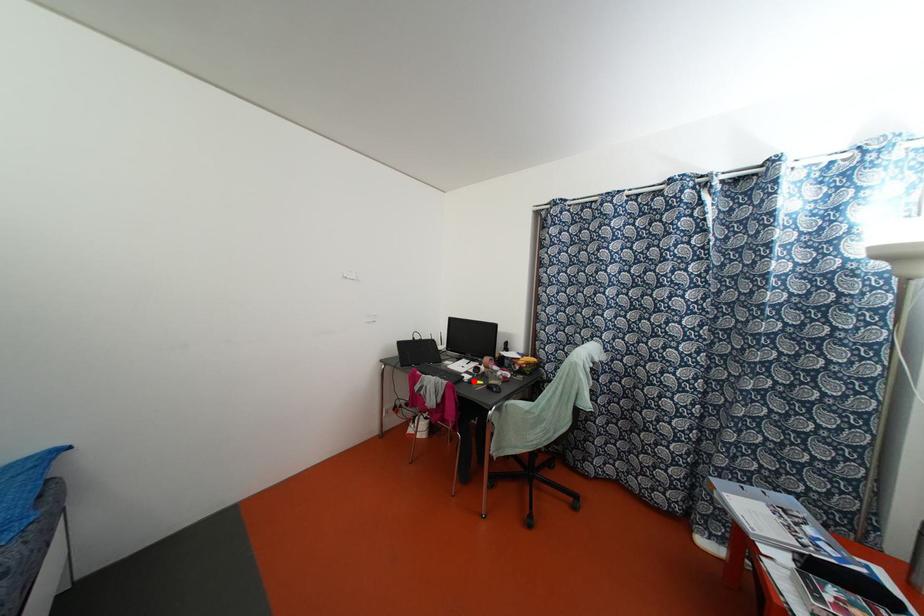
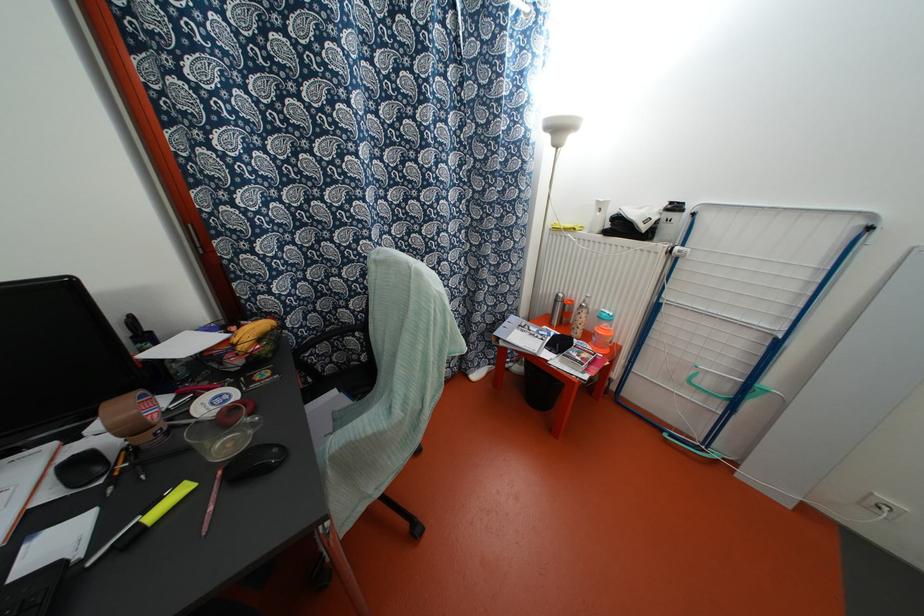
In the second image, find the point that corresponds to the highlighted location in the first image.

(152, 515)